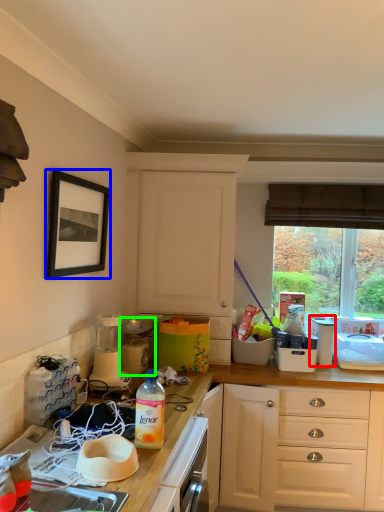
Question: Considering the real-world distances, which object is farthest from appliance (highlighted by a red box)? picture frame (highlighted by a blue box) or appliance (highlighted by a green box)?

Choices:
 (A) picture frame
 (B) appliance

Answer: (A)